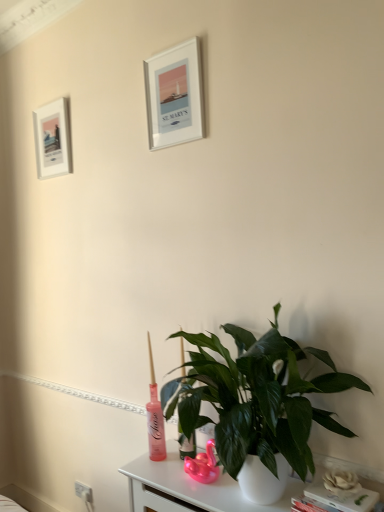
Question: Is silver metallic picture frame at upper center, which ranks as the 2th picture frame in left-to-right order, facing away from white matte picture frame at upper left, which appears as the second picture frame when viewed from the front?

Choices:
 (A) yes
 (B) no

Answer: (B)

Question: Can you confirm if silver metallic picture frame at upper center, which is counted as the first picture frame, starting from the right, is thinner than white matte picture frame at upper left, which appears as the first picture frame when viewed from the left?

Choices:
 (A) no
 (B) yes

Answer: (A)

Question: Does silver metallic picture frame at upper center, acting as the 1th picture frame starting from the front, have a lesser height compared to white matte picture frame at upper left, which appears as the first picture frame when viewed from the left?

Choices:
 (A) no
 (B) yes

Answer: (B)

Question: From a real-world perspective, is silver metallic picture frame at upper center, which ranks as the 2th picture frame in left-to-right order, positioned under white matte picture frame at upper left, which appears as the first picture frame when viewed from the left, based on gravity?

Choices:
 (A) no
 (B) yes

Answer: (A)

Question: Does silver metallic picture frame at upper center, which is counted as the first picture frame, starting from the right, lie in front of white matte picture frame at upper left, which appears as the second picture frame when viewed from the front?

Choices:
 (A) no
 (B) yes

Answer: (B)

Question: Is white matte book at lower right inside or outside of white glossy table at lower center?

Choices:
 (A) outside
 (B) inside

Answer: (A)

Question: Looking at their shapes, would you say white matte book at lower right is wider or thinner than white glossy table at lower center?

Choices:
 (A) thin
 (B) wide

Answer: (A)

Question: Would you say white matte book at lower right is to the left or to the right of white glossy table at lower center in the picture?

Choices:
 (A) left
 (B) right

Answer: (B)

Question: Is white matte book at lower right taller or shorter than white glossy table at lower center?

Choices:
 (A) short
 (B) tall

Answer: (A)

Question: Does point (354, 497) appear closer or farther from the camera than point (51, 133)?

Choices:
 (A) closer
 (B) farther

Answer: (A)

Question: Based on their positions, is white matte book at lower right located to the left or right of white matte picture frame at upper left, arranged as the 2th picture frame when viewed from the right?

Choices:
 (A) right
 (B) left

Answer: (A)

Question: Is white matte book at lower right in front of or behind white matte picture frame at upper left, which appears as the second picture frame when viewed from the front, in the image?

Choices:
 (A) front
 (B) behind

Answer: (A)

Question: Considering the positions of white matte book at lower right and white matte picture frame at upper left, acting as the first picture frame starting from the back, in the image, is white matte book at lower right wider or thinner than white matte picture frame at upper left, acting as the first picture frame starting from the back,?

Choices:
 (A) thin
 (B) wide

Answer: (B)

Question: Would you say green glossy plant at lower center is inside or outside white matte flower at lower right?

Choices:
 (A) inside
 (B) outside

Answer: (B)

Question: Considering the positions of point (177, 394) and point (337, 486), is point (177, 394) closer or farther from the camera than point (337, 486)?

Choices:
 (A) closer
 (B) farther

Answer: (B)